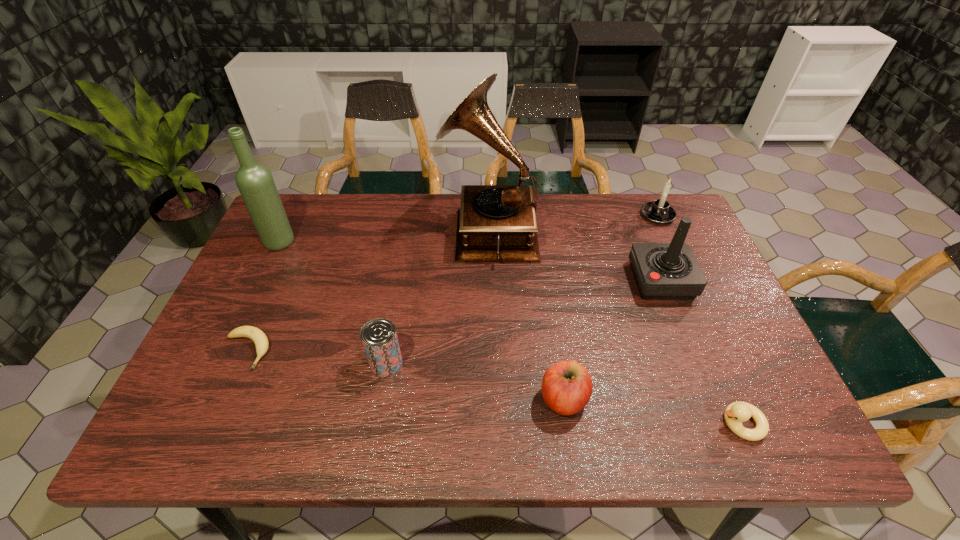
I want to click on vacant space located on the horn of the record player, so click(x=323, y=230).

Find the location of a particular element. vacant region located on the front of the wine bottle is located at coordinates (260, 282).

Identify the location of blank space located 0.160m on the front-facing side of the joystick. (573, 281).

Where is `free space located 0.200m on the front-facing side of the joystick`? The height and width of the screenshot is (540, 960). free space located 0.200m on the front-facing side of the joystick is located at coordinates (559, 281).

The height and width of the screenshot is (540, 960). I want to click on vacant space located 0.370m on the front-facing side of the joystick, so 496,281.

The height and width of the screenshot is (540, 960). Find the location of `vacant point located with a handle on the side of the candle holder`. vacant point located with a handle on the side of the candle holder is located at coordinates (705, 320).

This screenshot has height=540, width=960. I want to click on free space located on the right of the beer can, so tap(544, 363).

You are a GUI agent. You are given a task and a screenshot of the screen. Output one action in this format:
    pyautogui.click(x=<x>, y=<y>)
    Task: Click on the blank area located 0.190m on the left of the apple
    The width and height of the screenshot is (960, 540).
    Given the screenshot: What is the action you would take?
    pyautogui.click(x=452, y=399)

At what (x,y) coordinates should I click in order to perform the action: click on vacant space located at the beak of the second shortest object. Please return your answer as a coordinate pair (x, y). The width and height of the screenshot is (960, 540). Looking at the image, I should click on (541, 423).

The height and width of the screenshot is (540, 960). In order to click on free point located at the beak of the second shortest object in this screenshot , I will do (x=632, y=423).